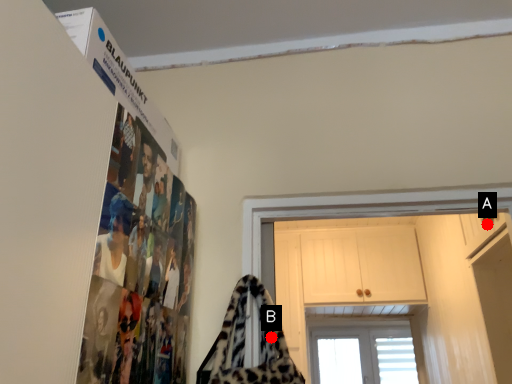
Question: Two points are circled on the image, labeled by A and B beside each circle. Which point is farther to the camera?

Choices:
 (A) A is further
 (B) B is further

Answer: (A)